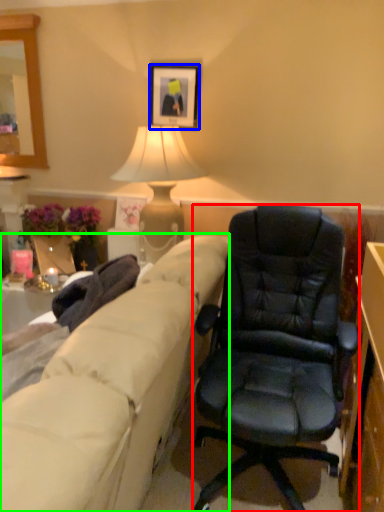
Question: Estimate the real-world distances between objects in this image. Which object is closer to chair (highlighted by a red box), picture frame (highlighted by a blue box) or studio couch (highlighted by a green box)?

Choices:
 (A) picture frame
 (B) studio couch

Answer: (B)